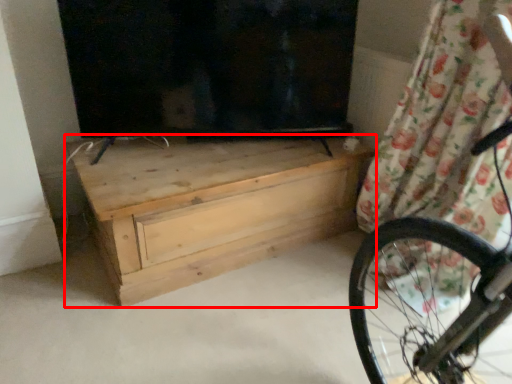
Question: Observing the image, what is the correct spatial positioning of chest of drawers (annotated by the red box) in reference to curtain?

Choices:
 (A) left
 (B) right

Answer: (A)